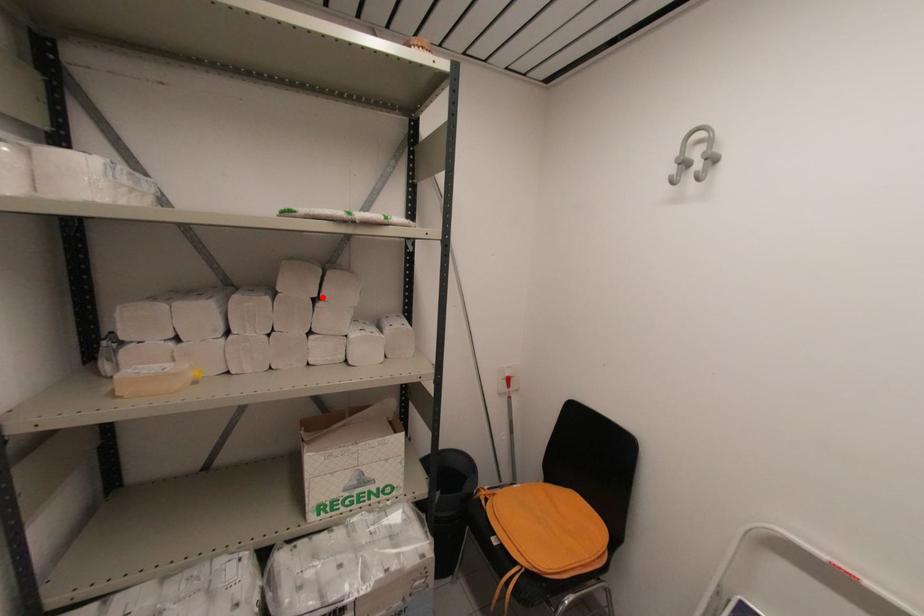
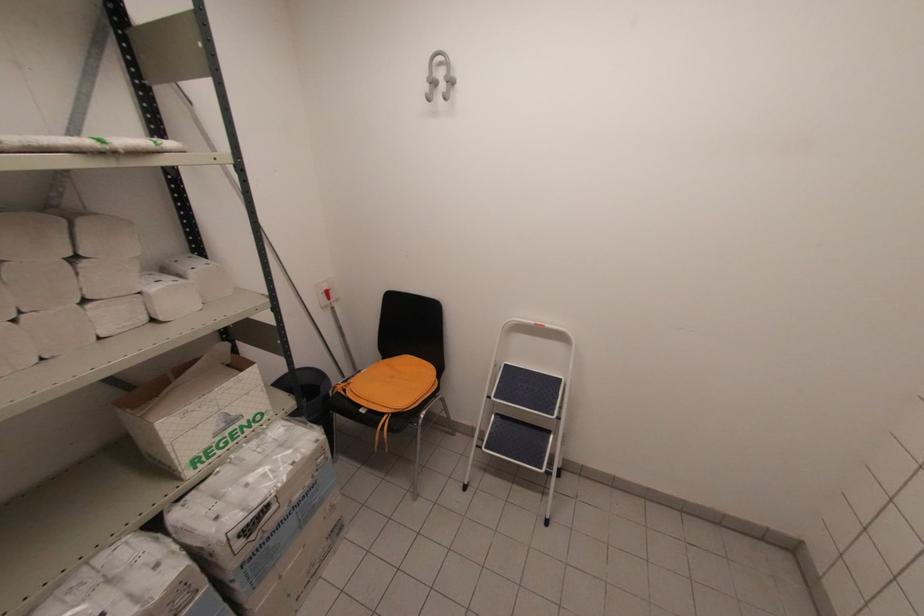
Where in the second image is the point corresponding to the highlighted location from the first image?

(81, 254)